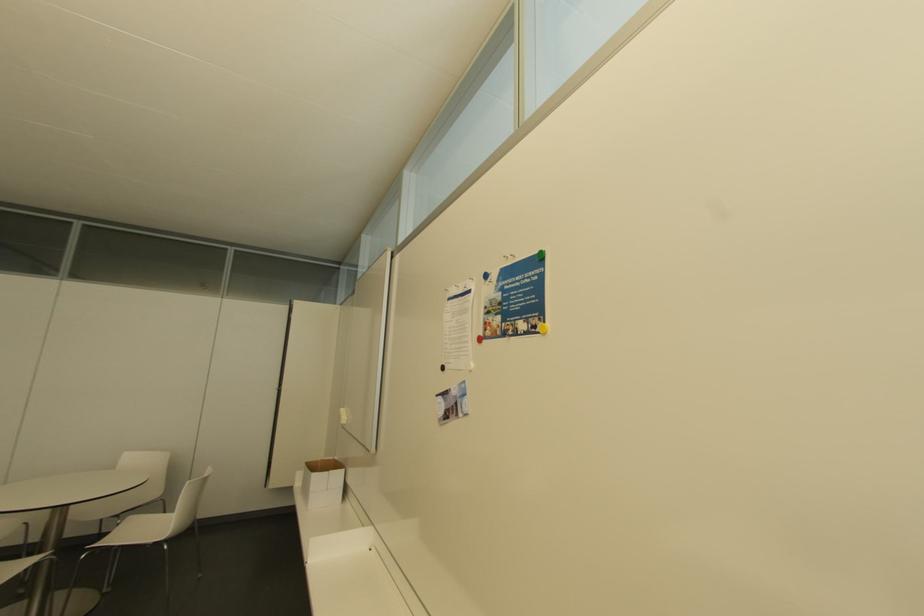
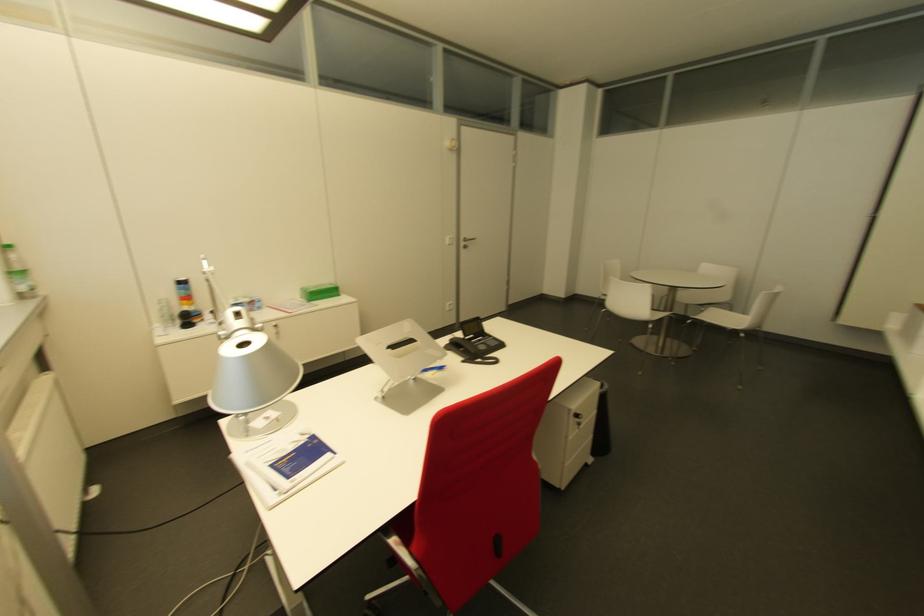
The first image is from the beginning of the video and the second image is from the end. How did the camera likely rotate when shooting the video?

The camera's rotation is toward left-down.